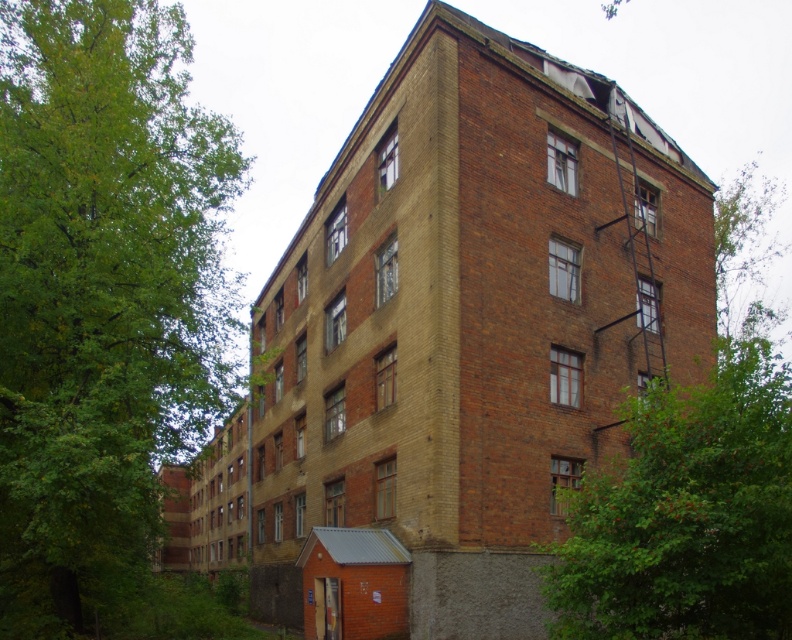
You are a gardener assessing the growth of two green leafy trees in front of an old building. The trees are labeled as the green leafy tree at left and the green leafy tree at center. Which tree has a larger size?

The green leafy tree at left is bigger than the green leafy tree at center, so the tree at the left has a larger size.

You are a gardener assessing the space between two green leafy trees. You need to plant a new shrub that requires 3 meters of space to grow. Based on the image, can the space between the green leafy tree at left and the green leafy tree at center accommodate this shrub?

The green leafy tree at left has a lesser width compared to green leafy tree at center. Therefore, the space between them may be sufficient for the shrub requiring 3 meters, but the exact distance isn

You are standing at the base of the green leafy tree at left and want to throw a ball to a friend standing at the building entrance. The ball can travel 15 meters. Will it reach?

The distance between you and the building entrance is not specified in the provided information. The given distance is between the green leafy tree at left and the viewer, which is 17.78 meters. Since the ball can only travel 15 meters, it won not reach.